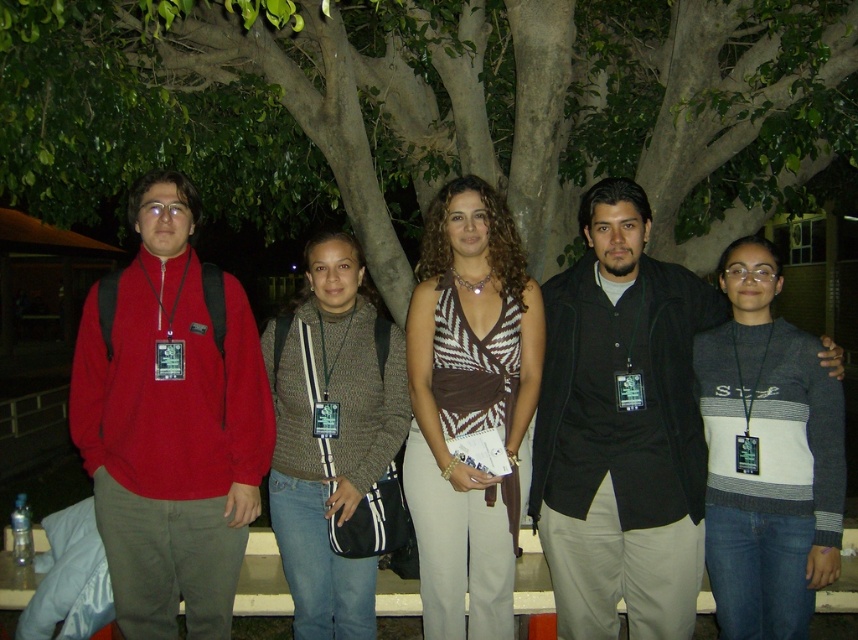
Does point (391, 76) lie in front of point (349, 636)?

No, it is behind (349, 636).

Does green leafy tree at center have a larger size compared to knit sweater at center?

Indeed, green leafy tree at center has a larger size compared to knit sweater at center.

Describe the element at coordinates (432, 108) in the screenshot. Image resolution: width=858 pixels, height=640 pixels. I see `green leafy tree at center` at that location.

At what (x,y) coordinates should I click in order to perform the action: click on green leafy tree at center. Please return your answer as a coordinate pair (x, y). Image resolution: width=858 pixels, height=640 pixels. Looking at the image, I should click on (432, 108).

Can you confirm if matte red sweater at left is positioned to the left of brown textured top at center?

Correct, you'll find matte red sweater at left to the left of brown textured top at center.

Can you confirm if matte red sweater at left is smaller than brown textured top at center?

Indeed, matte red sweater at left has a smaller size compared to brown textured top at center.

Where is `matte red sweater at left`? Image resolution: width=858 pixels, height=640 pixels. matte red sweater at left is located at coordinates click(171, 420).

Is green leafy tree at center smaller than dark gray vest at center?

No, green leafy tree at center is not smaller than dark gray vest at center.

Is green leafy tree at center taller than dark gray vest at center?

Yes.

Identify the location of green leafy tree at center. This screenshot has height=640, width=858. (432, 108).